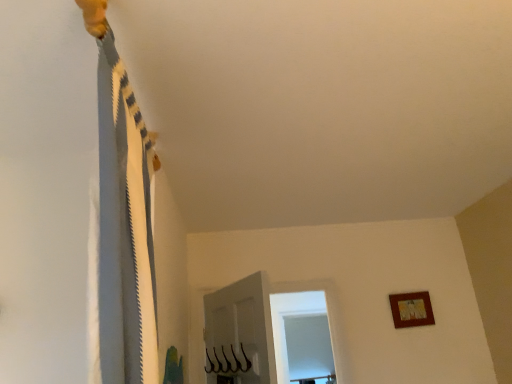
In order to click on wooden frame at lower right in this screenshot , I will do `click(411, 309)`.

The width and height of the screenshot is (512, 384). What do you see at coordinates (411, 309) in the screenshot? I see `wooden frame at lower right` at bounding box center [411, 309].

This screenshot has width=512, height=384. I want to click on wooden frame at lower right, so click(x=411, y=309).